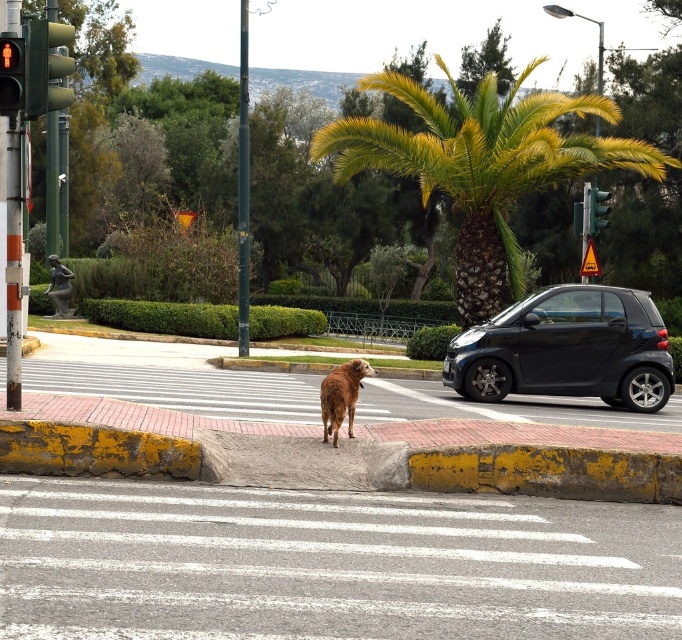
Who is taller, green matte traffic light at upper left or brown furry dog at center?

With more height is brown furry dog at center.

Where is `green matte traffic light at upper left`? This screenshot has height=640, width=682. green matte traffic light at upper left is located at coordinates (46, 67).

Who is more forward, (46, 108) or (329, 388)?

Point (46, 108)

Locate an element on the screen. green matte traffic light at upper left is located at coordinates (46, 67).

Who is more distant from viewer, (494, 356) or (5, 99)?

Point (494, 356)

Does black glossy car at right have a larger size compared to red matte pedestrian signal at left?

Indeed, black glossy car at right has a larger size compared to red matte pedestrian signal at left.

Which is in front, point (599, 336) or point (1, 54)?

Point (1, 54)

Locate an element on the screen. black glossy car at right is located at coordinates (567, 349).

Is green matte traffic light at upper left below red matte pedestrian signal at left?

No, green matte traffic light at upper left is not below red matte pedestrian signal at left.

Is green matte traffic light at upper left thinner than red matte pedestrian signal at left?

Indeed, green matte traffic light at upper left has a lesser width compared to red matte pedestrian signal at left.

At what (x,y) coordinates should I click in order to perform the action: click on green matte traffic light at upper left. Please return your answer as a coordinate pair (x, y). The height and width of the screenshot is (640, 682). Looking at the image, I should click on (46, 67).